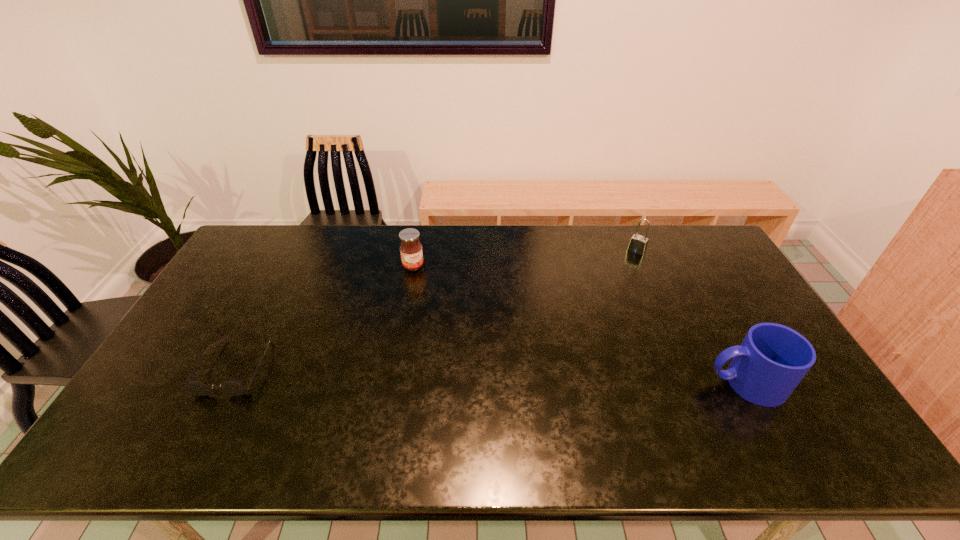
The height and width of the screenshot is (540, 960). I want to click on free location located on the label side of the second farthest object, so click(440, 307).

At what (x,y) coordinates should I click in order to perform the action: click on vacant space located on the label side of the second farthest object. Please return your answer as a coordinate pair (x, y). Looking at the image, I should click on (437, 303).

Identify the location of free space located 0.180m on the shackle of the farthest object. (613, 282).

Where is `vacant space located on the shackle of the farthest object`? This screenshot has height=540, width=960. vacant space located on the shackle of the farthest object is located at coordinates (619, 274).

Locate an element on the screen. This screenshot has width=960, height=540. free space located on the shackle of the farthest object is located at coordinates (625, 266).

The height and width of the screenshot is (540, 960). Find the location of `jam present at the far edge`. jam present at the far edge is located at coordinates (411, 253).

This screenshot has width=960, height=540. I want to click on padlock at the far edge, so click(638, 244).

Locate an element on the screen. The height and width of the screenshot is (540, 960). sunglasses that is at the near edge is located at coordinates (234, 387).

I want to click on mug at the near edge, so click(x=772, y=360).

This screenshot has width=960, height=540. I want to click on object positioned at the left edge, so click(234, 387).